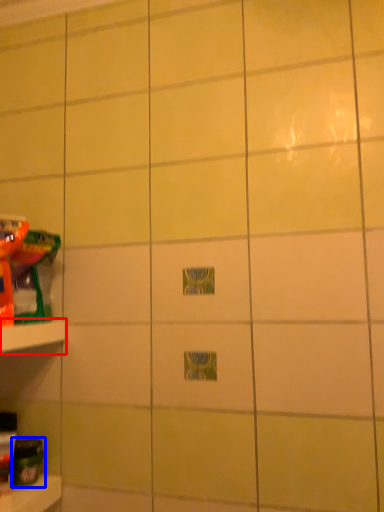
Question: Which object is closer to the camera taking this photo, shelf (highlighted by a red box) or toy (highlighted by a blue box)?

Choices:
 (A) shelf
 (B) toy

Answer: (A)